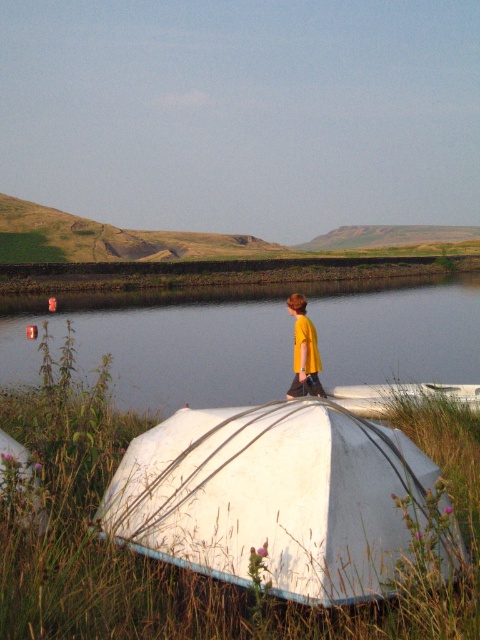
From the picture: Can you confirm if transparent water at boat right is bigger than yellow fabric shirt at center?

Indeed, transparent water at boat right has a larger size compared to yellow fabric shirt at center.

Can you confirm if transparent water at boat right is positioned above yellow fabric shirt at center?

Yes, transparent water at boat right is above yellow fabric shirt at center.

Is point (172, 307) in front of point (308, 321)?

No, (172, 307) is further to viewer.

Find the location of a particular element. The height and width of the screenshot is (640, 480). transparent water at boat right is located at coordinates (252, 337).

What do you see at coordinates (274, 497) in the screenshot?
I see `white fabric boat at lower center` at bounding box center [274, 497].

Locate an element on the screen. Image resolution: width=480 pixels, height=640 pixels. white fabric boat at lower center is located at coordinates (274, 497).

Does white fabric boat at lower center appear over transparent water at boat right?

No.

Does white fabric boat at lower center appear on the right side of transparent water at boat right?

Yes, white fabric boat at lower center is to the right of transparent water at boat right.

Which is behind, point (310, 492) or point (183, 364)?

The point (183, 364) is behind.

Identify the location of white fabric boat at lower center. (274, 497).